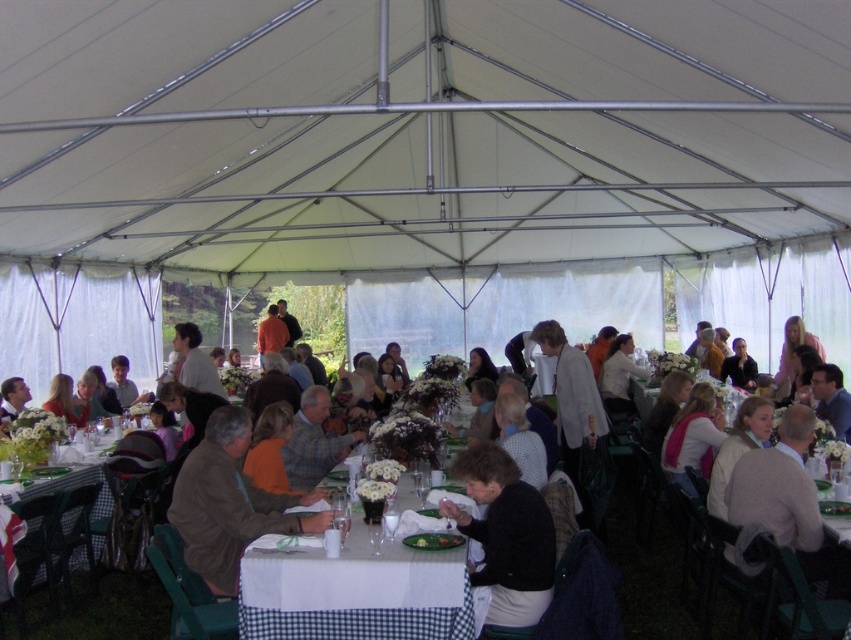
Question: Among these objects, which one is farthest from the camera?

Choices:
 (A) brown leather jacket at center
 (B) white checkered tablecloth at center

Answer: (A)

Question: Based on their relative distances, which object is nearer to the black sweater at center?

Choices:
 (A) brown leather jacket at center
 (B) white fabric canopy at upper center

Answer: (A)

Question: Does white checkered tablecloth at lower left have a lesser width compared to matte brown shirt at center?

Choices:
 (A) no
 (B) yes

Answer: (A)

Question: Which point is farther to the camera?

Choices:
 (A) (475, 497)
 (B) (230, 577)
 (C) (397, 604)
 (D) (200, 353)

Answer: (D)

Question: Does white fabric canopy at upper center lie behind brown leather jacket at center?

Choices:
 (A) yes
 (B) no

Answer: (B)

Question: Does white checkered tablecloth at center come behind white checkered tablecloth at lower left?

Choices:
 (A) yes
 (B) no

Answer: (B)